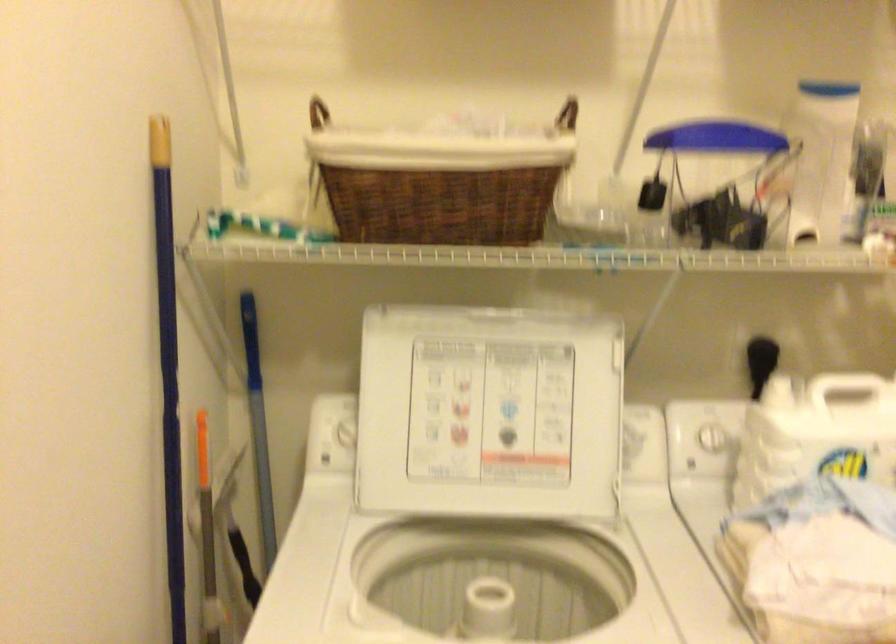
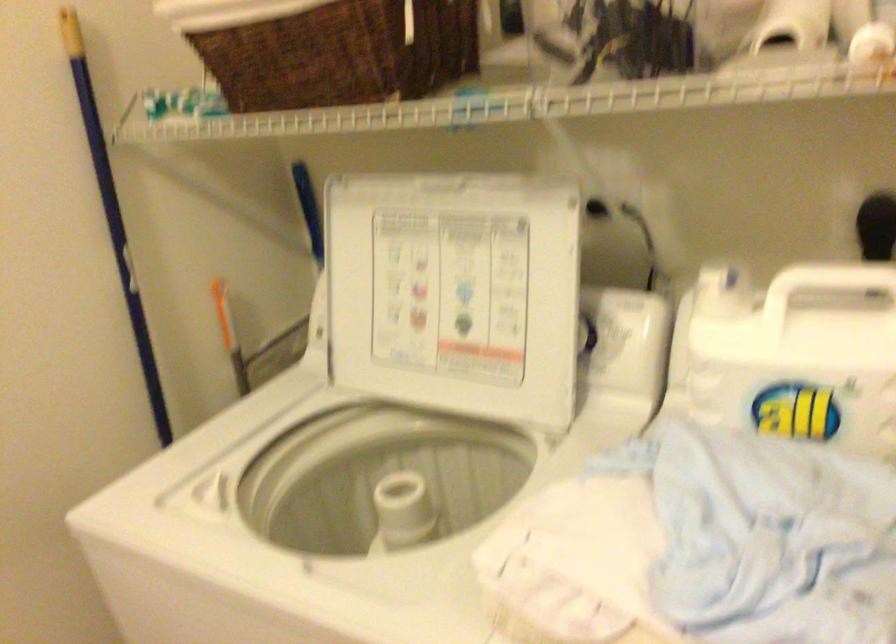
The point at (634,431) is marked in the first image. Where is the corresponding point in the second image?

(616, 325)